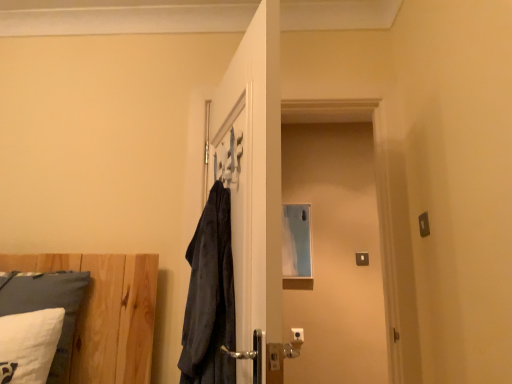
The height and width of the screenshot is (384, 512). What do you see at coordinates (47, 305) in the screenshot? I see `white soft pillow at lower left` at bounding box center [47, 305].

This screenshot has height=384, width=512. Identify the location of white soft pillow at lower left. (47, 305).

Image resolution: width=512 pixels, height=384 pixels. Describe the element at coordinates (335, 244) in the screenshot. I see `transparent glass screen door at center` at that location.

Locate an element on the screen. The image size is (512, 384). transparent glass screen door at center is located at coordinates (335, 244).

Where is `white soft pillow at lower left`? The width and height of the screenshot is (512, 384). white soft pillow at lower left is located at coordinates pyautogui.click(x=47, y=305).

Between transparent glass screen door at center and white soft pillow at lower left, which one appears on the left side from the viewer's perspective?

Positioned to the left is white soft pillow at lower left.

In the image, is transparent glass screen door at center positioned in front of or behind white soft pillow at lower left?

transparent glass screen door at center is positioned farther from the viewer than white soft pillow at lower left.

Is point (381, 376) in front of point (77, 282)?

No, it is not.

Consider the image. From the image's perspective, is transparent glass screen door at center located above or below white soft pillow at lower left?

Based on their image positions, transparent glass screen door at center is located above white soft pillow at lower left.

From a real-world perspective, is transparent glass screen door at center located beneath white soft pillow at lower left?

Actually, transparent glass screen door at center is physically above white soft pillow at lower left in the real world.

Can you confirm if transparent glass screen door at center is wider than white soft pillow at lower left?

In fact, transparent glass screen door at center might be narrower than white soft pillow at lower left.

In terms of height, does transparent glass screen door at center look taller or shorter compared to white soft pillow at lower left?

transparent glass screen door at center is taller than white soft pillow at lower left.

Is transparent glass screen door at center smaller than white soft pillow at lower left?

Actually, transparent glass screen door at center might be larger than white soft pillow at lower left.

Is transparent glass screen door at center located outside white soft pillow at lower left?

Indeed, transparent glass screen door at center is completely outside white soft pillow at lower left.

Are transparent glass screen door at center and white soft pillow at lower left beside each other?

transparent glass screen door at center is not next to white soft pillow at lower left, and they're not touching.

Could you tell me if transparent glass screen door at center is facing white soft pillow at lower left?

No, transparent glass screen door at center is not aimed at white soft pillow at lower left.

What's the angular difference between transparent glass screen door at center and white soft pillow at lower left's facing directions?

transparent glass screen door at center and white soft pillow at lower left are facing 3.09 degrees away from each other.

The image size is (512, 384). Identify the location of screen door that is behind the white soft pillow at lower left. (335, 244).

Based on the photo, which object is positioned more to the left, white soft pillow at lower left or transparent glass screen door at center?

Positioned to the left is white soft pillow at lower left.

In the image, is white soft pillow at lower left positioned in front of or behind transparent glass screen door at center?

Clearly, white soft pillow at lower left is in front of transparent glass screen door at center.

Is point (23, 306) closer to viewer compared to point (359, 290)?

That is True.

Based on the photo, from the image's perspective, who appears lower, white soft pillow at lower left or transparent glass screen door at center?

white soft pillow at lower left, from the image's perspective.

From a real-world perspective, is white soft pillow at lower left above or below transparent glass screen door at center?

white soft pillow at lower left is below transparent glass screen door at center.

Considering the relative sizes of white soft pillow at lower left and transparent glass screen door at center in the image provided, is white soft pillow at lower left thinner than transparent glass screen door at center?

Incorrect, the width of white soft pillow at lower left is not less than that of transparent glass screen door at center.

Can you confirm if white soft pillow at lower left is shorter than transparent glass screen door at center?

Yes, white soft pillow at lower left is shorter than transparent glass screen door at center.

Between white soft pillow at lower left and transparent glass screen door at center, which one has larger size?

transparent glass screen door at center.

Does white soft pillow at lower left contain transparent glass screen door at center?

No, transparent glass screen door at center is not inside white soft pillow at lower left.

Based on the photo, are white soft pillow at lower left and transparent glass screen door at center located far from each other?

Indeed, white soft pillow at lower left is not near transparent glass screen door at center.

Is white soft pillow at lower left looking in the opposite direction of transparent glass screen door at center?

No, transparent glass screen door at center is not at the back of white soft pillow at lower left.

How distant is white soft pillow at lower left from transparent glass screen door at center?

A distance of 1.79 meters exists between white soft pillow at lower left and transparent glass screen door at center.

Identify the location of screen door above the white soft pillow at lower left (from a real-world perspective). (335, 244).

Locate an element on the screen. This screenshot has width=512, height=384. screen door above the white soft pillow at lower left (from a real-world perspective) is located at coordinates (335, 244).

Identify the location of pillow below the transparent glass screen door at center (from a real-world perspective). This screenshot has height=384, width=512. (47, 305).